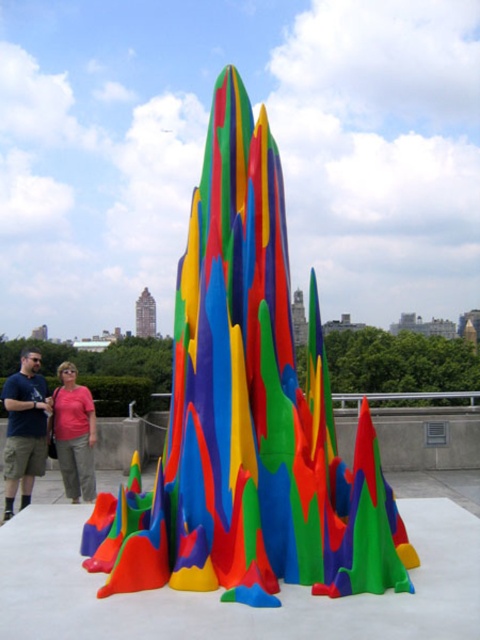
Based on the photo, what is located at the coordinates point (248,416)?

The glossy plastic sculpture at center is located at point (248,416).

You are standing on the rooftop and want to place a new decorative item exactly at the location marked by the point coordinates point (x=248, y=416). What object is currently occupying that spot?

The point (x=248, y=416) marks the glossy plastic sculpture at center, so the glossy plastic sculpture at center is currently occupying that spot.